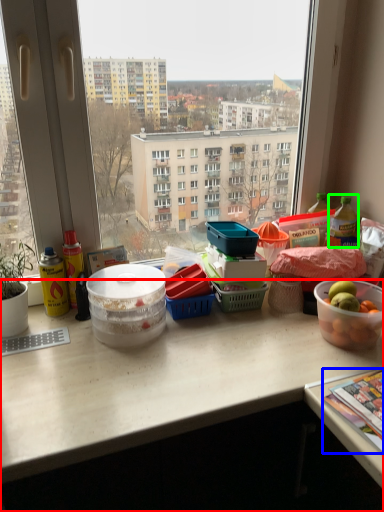
Question: Considering the real-world distances, which object is closest to desk (highlighted by a red box)? magazine (highlighted by a blue box) or bottle (highlighted by a green box).

Choices:
 (A) magazine
 (B) bottle

Answer: (A)